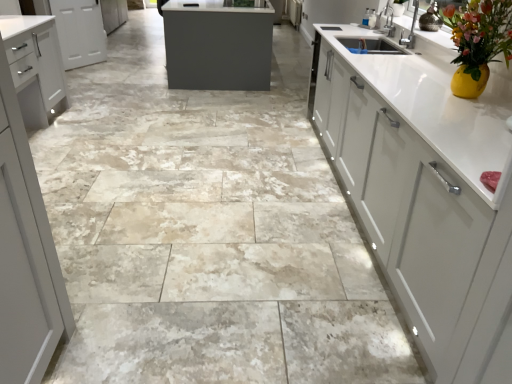
Image resolution: width=512 pixels, height=384 pixels. Find the location of `vacant area located to the right-hand side of white matte cabinet at left, arranged as the first cabinetry when ordered from the bottom`. vacant area located to the right-hand side of white matte cabinet at left, arranged as the first cabinetry when ordered from the bottom is located at coordinates (93, 136).